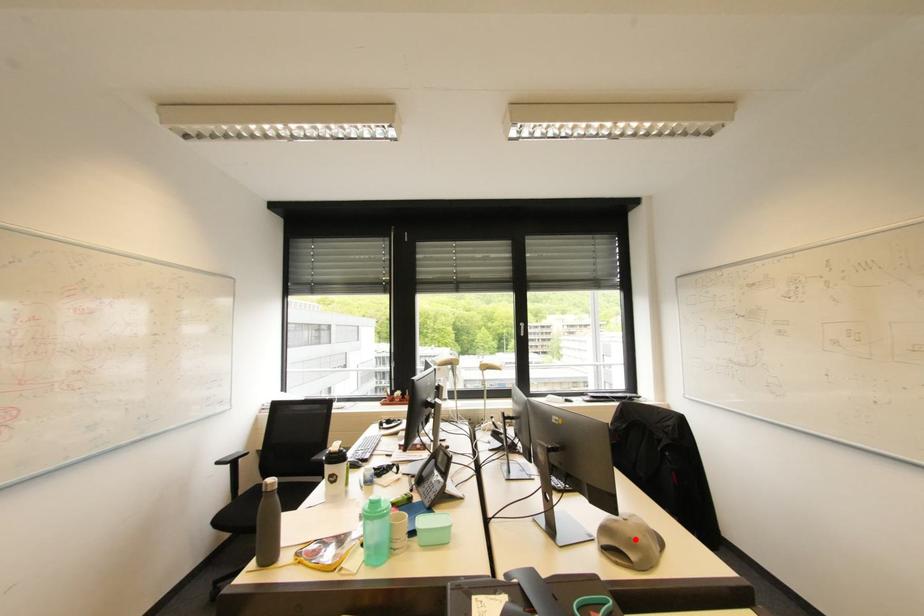
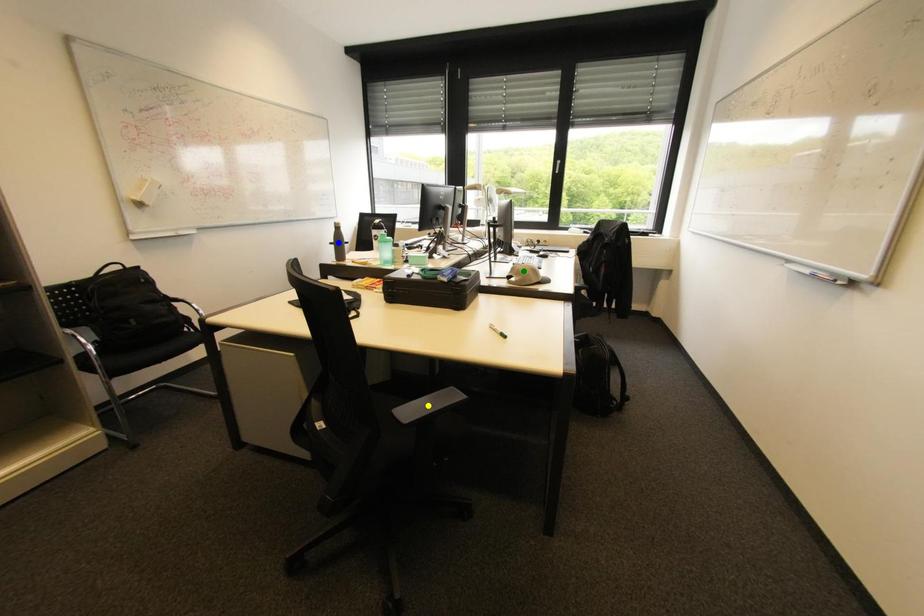
Question: I am providing you with two images of the same scene from different viewpoints. A red point is marked on the first image. You are given multiple points on the second image. Which mark in image 2 goes with the point in image 1?

Choices:
 (A) green point
 (B) yellow point
 (C) blue point

Answer: (A)